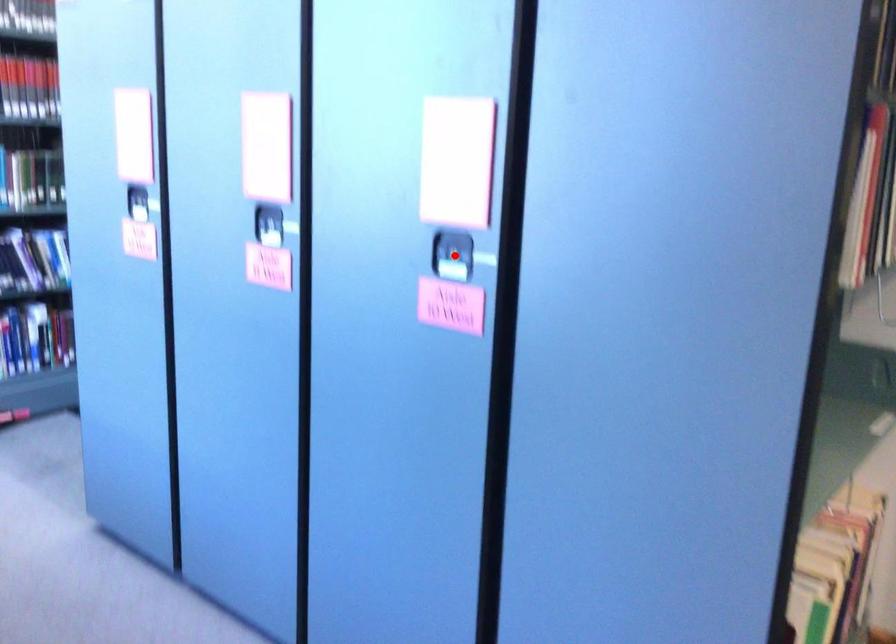
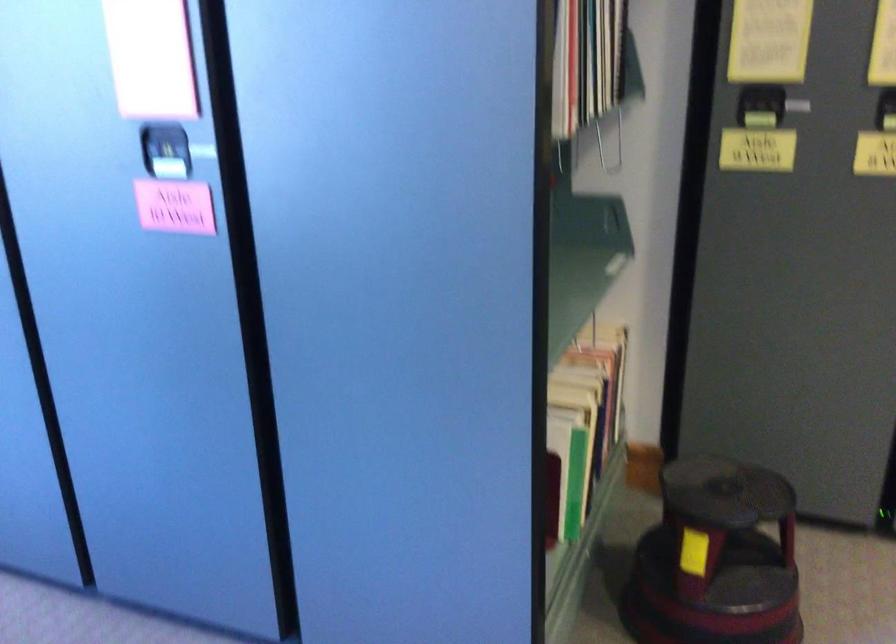
Locate, in the second image, the point that corresponds to the highlighted location in the first image.

(165, 151)